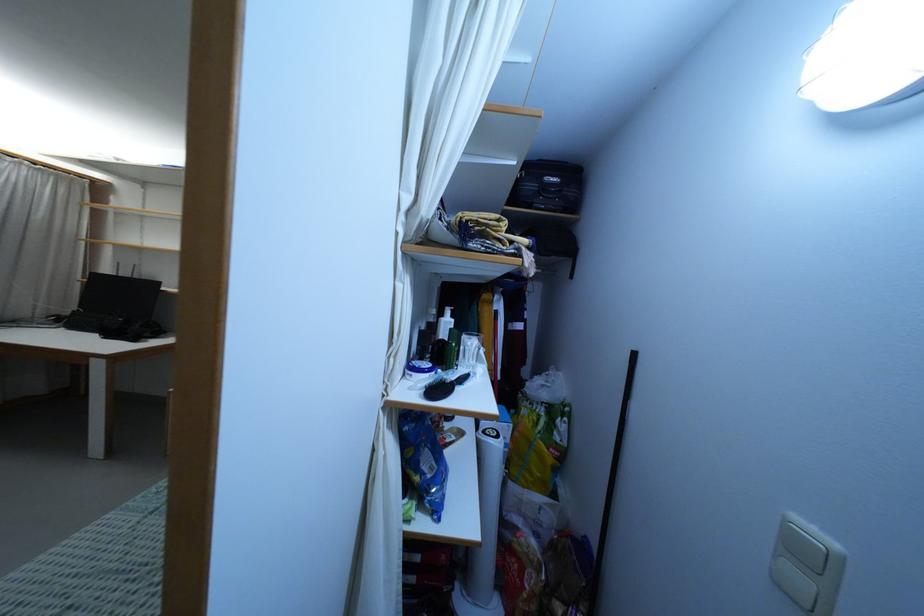
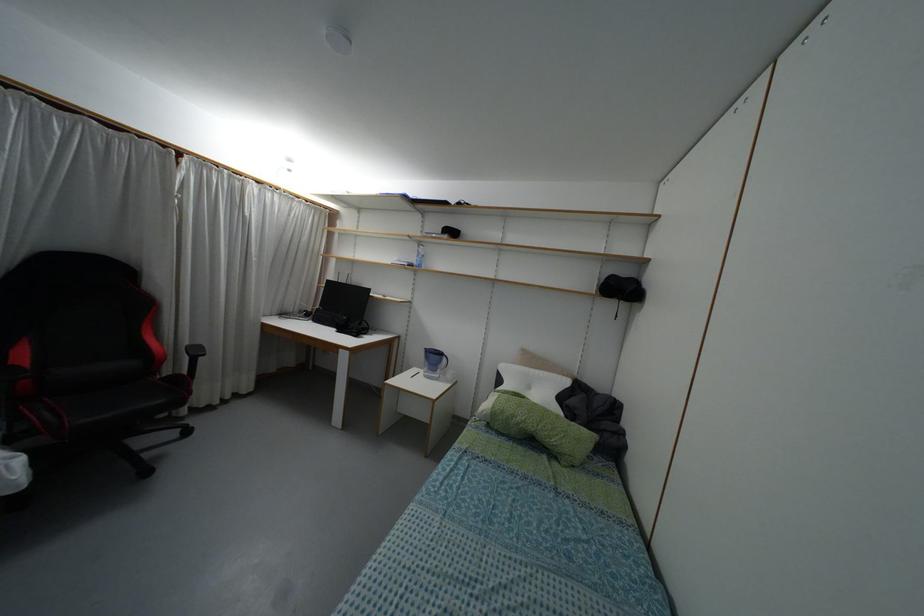
Question: What movement of the cameraman would produce the second image?

Choices:
 (A) Left
 (B) Right
 (C) Forward
 (D) Backward

Answer: (A)